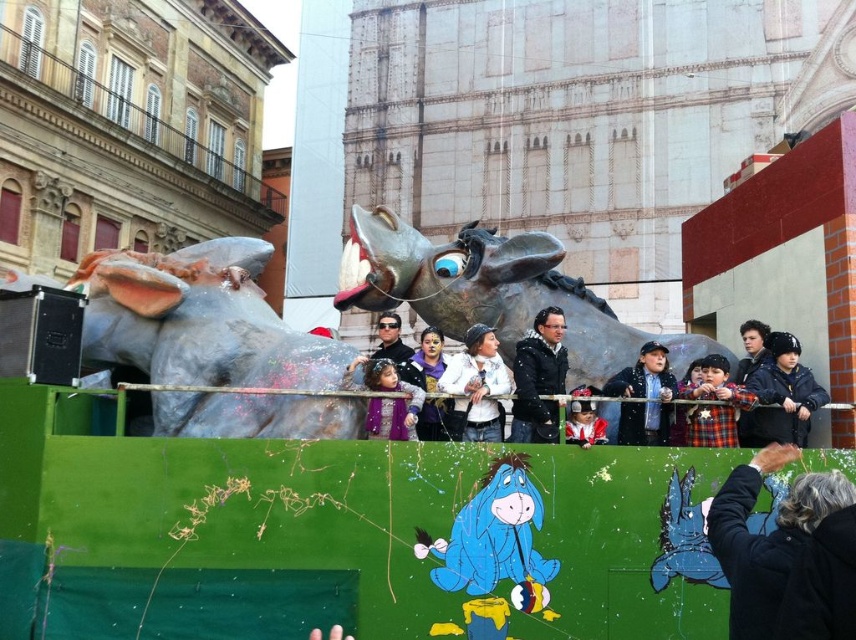
You are a photographer trying to capture both the plaid fabric child at center and the plush purple coat at center in the same frame. Which object should you focus on first to ensure both fit in the photo?

The plaid fabric child at center is wider than the plush purple coat at center, so focusing on the plaid fabric child at center first will ensure both fit in the photo.

You are a photographer standing at the back of the crowd watching the parade. You want to take a photo of both the plaid fabric child at center and the plush purple coat at center in the same frame. Given that your camera has a maximum focus range of 30 feet, will you be able to capture both subjects clearly in one shot?

The distance between the plaid fabric child at center and the plush purple coat at center is 34.77 feet. Since your camera can only focus up to 30 feet, you won cannot capture both subjects clearly in one shot because the distance exceeds the camera range.